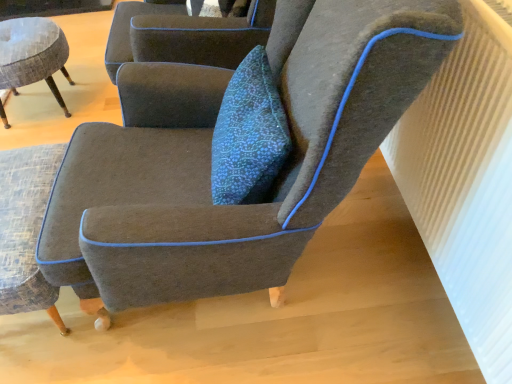
The width and height of the screenshot is (512, 384). Identify the location of free point above textured gray armchair at lower left, positioned as the second chair in left-to-right order (from a real-world perspective). (21, 195).